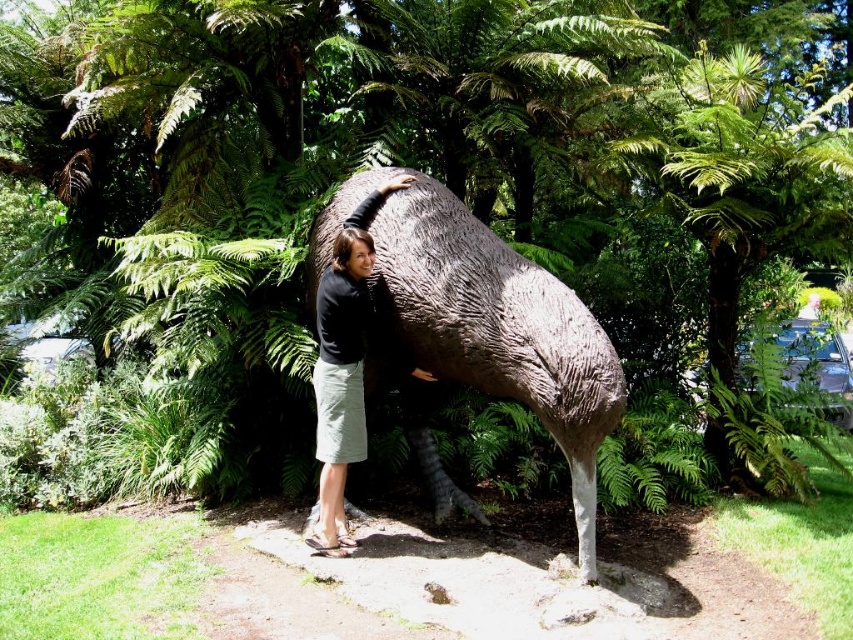
You are a photographer trying to capture a clear shot of the rough textured statue at center and the matte black shirt at center. Since the statue and the shirt are in the same area, will the statue block the view of the shirt in your photo?

The rough textured statue at center is located above the matte black shirt at center, so the statue will partially block the view of the shirt in the photo.

You are a photographer trying to capture the rough textured statue at center in your shot. Based on its position, where should you aim your camera to ensure it is centered in the frame?

The rough textured statue at center is located at coordinates 0.517 on the x axis and 0.579 on the y axis, so you should aim your camera at those coordinates to center it in the frame.

You are standing in a garden with a rough textured statue at center. You want to take a photo of the statue without any people in the background. The statue is 12.75 feet away from you. If you move forward 5 feet, will you still be able to capture the entire statue in your camera frame?

Moving forward 5 feet would bring you to 7.75 feet away from the rough textured statue at center. Whether the entire statue fits depends on your camera lens and angle, but reducing distance may require a wider angle or closer crop, potentially excluding parts of the statue.